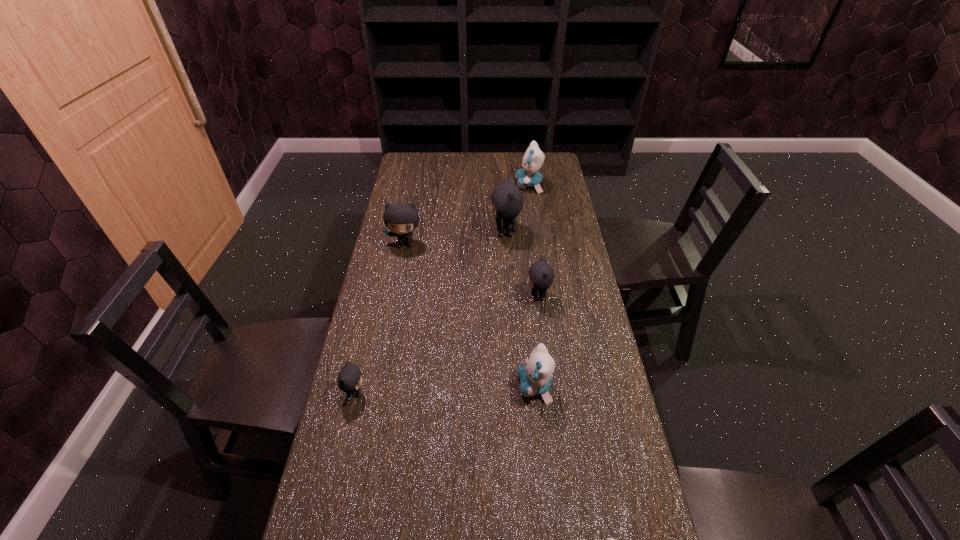
Where is `free spot located 0.100m on the front-facing side of the fourth nearest object`? free spot located 0.100m on the front-facing side of the fourth nearest object is located at coordinates (496, 297).

Identify the location of vacant space located on the front-facing side of the smallest gray kitten. This screenshot has height=540, width=960. (471, 393).

Find the location of `object situated at the far edge`. object situated at the far edge is located at coordinates (533, 158).

Find the location of a particular element. object present at the far right corner is located at coordinates (533, 158).

Where is `vacant space at the far edge`? vacant space at the far edge is located at coordinates pos(477,156).

Image resolution: width=960 pixels, height=540 pixels. In the image, there is a desktop. Find the location of `free space at the left edge`. free space at the left edge is located at coordinates (407, 301).

You are a GUI agent. You are given a task and a screenshot of the screen. Output one action in this format:
    pyautogui.click(x=<x>, y=<y>)
    Task: Click on the free space at the right edge of the desktop
    The image size is (960, 540).
    Given the screenshot: What is the action you would take?
    pyautogui.click(x=554, y=215)

At what (x,y) coordinates should I click in order to perform the action: click on unoccupied position between the biggest gray kitten and the second nearest blue kitten. Please return your answer as a coordinate pair (x, y). Looking at the image, I should click on (520, 309).

The image size is (960, 540). What are the coordinates of `free spot between the biggest gray kitten and the second farthest blue kitten` in the screenshot? It's located at (520, 309).

Identify the location of vacant space in between the farthest object and the third smallest gray kitten. Image resolution: width=960 pixels, height=540 pixels. (468, 214).